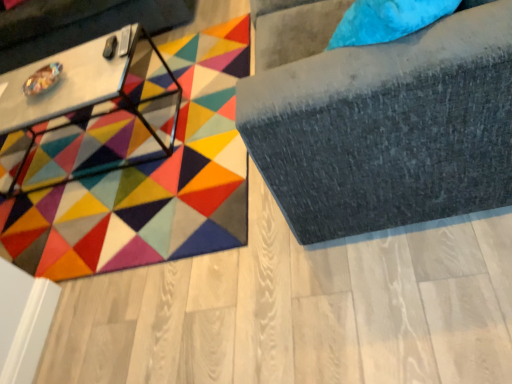
Question: Does point (420, 172) appear closer or farther from the camera than point (126, 13)?

Choices:
 (A) farther
 (B) closer

Answer: (B)

Question: From a real-world perspective, is suede gray sofa at upper right above or below metallic silver swivel chair at left?

Choices:
 (A) below
 (B) above

Answer: (B)

Question: Estimate the real-world distances between objects in this image. Which object is farther from the multicolored felt mat at center?

Choices:
 (A) white glossy table at upper left
 (B) suede gray sofa at upper right
 (C) metallic silver swivel chair at left

Answer: (B)

Question: Considering the real-world distances, which object is farthest from the suede gray sofa at upper right?

Choices:
 (A) white glossy table at upper left
 (B) multicolored felt mat at center
 (C) metallic silver swivel chair at left

Answer: (C)